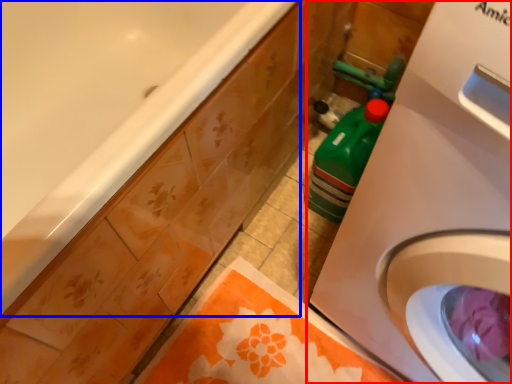
Question: Which point is further to the camera, washing machine (highlighted by a red box) or bathtub (highlighted by a blue box)?

Choices:
 (A) washing machine
 (B) bathtub

Answer: (B)